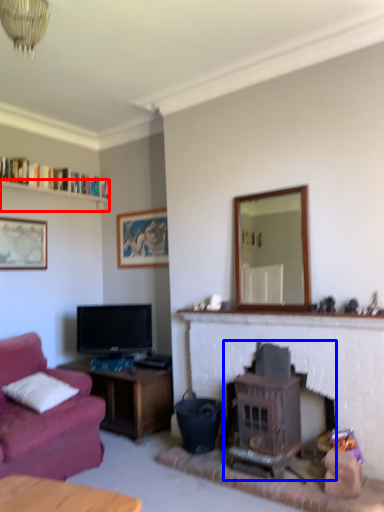
Question: Which point is further to the camera, shelf (highlighted by a red box) or wood burning stove (highlighted by a blue box)?

Choices:
 (A) shelf
 (B) wood burning stove

Answer: (A)